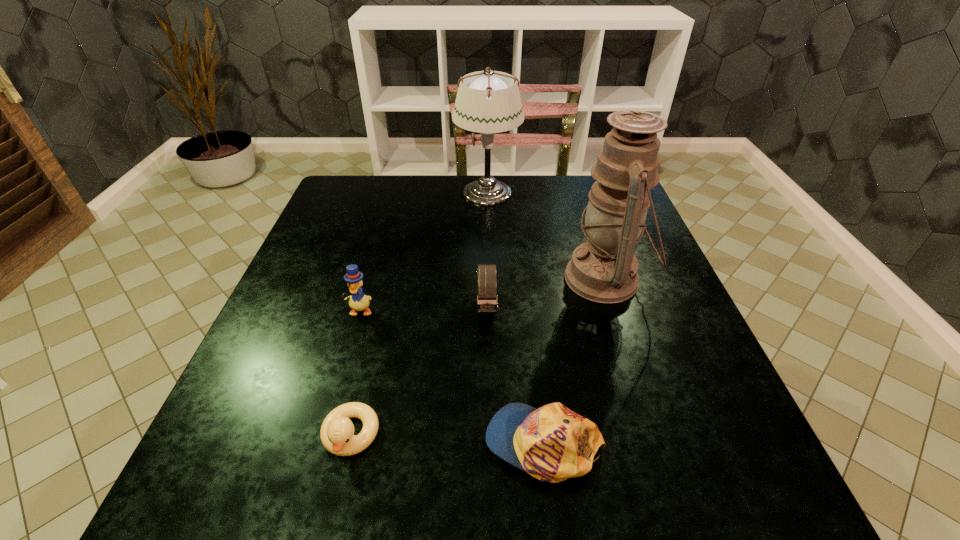
Find the location of a particular element. Image resolution: width=960 pixels, height=540 pixels. free space located 0.170m on the face of the farther duckling, where the monocle is placed is located at coordinates (338, 389).

At what (x,y) coordinates should I click in order to perform the action: click on free space located on the face of the watch. Please return your answer as a coordinate pair (x, y). This screenshot has height=540, width=960. Looking at the image, I should click on (488, 354).

Where is `free location located on the bill of the cap`? The image size is (960, 540). free location located on the bill of the cap is located at coordinates (396, 443).

The width and height of the screenshot is (960, 540). I want to click on free space located 0.380m on the bill of the cap, so click(245, 443).

Identify the location of free space located on the bill of the cap. The width and height of the screenshot is (960, 540). (321, 443).

This screenshot has height=540, width=960. In order to click on object located in the far edge section of the desktop in this screenshot , I will do `click(488, 102)`.

You are a GUI agent. You are given a task and a screenshot of the screen. Output one action in this format:
    pyautogui.click(x=<x>, y=<y>)
    Task: Click on the cap located at the near edge
    The image size is (960, 540).
    Given the screenshot: What is the action you would take?
    pyautogui.click(x=552, y=443)

Locate an element on the screen. The image size is (960, 540). duckling that is at the near edge is located at coordinates (337, 435).

The height and width of the screenshot is (540, 960). I want to click on object positioned at the left edge, so click(358, 301).

The width and height of the screenshot is (960, 540). Find the location of `object that is at the right edge`. object that is at the right edge is located at coordinates (604, 269).